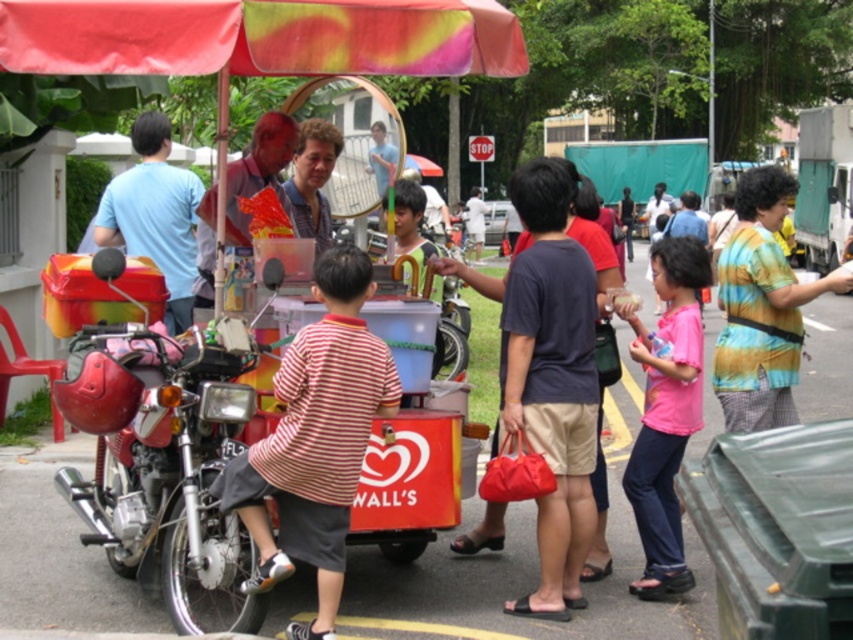
You are standing at the food stall and want to reach the point marked as point (161,182). Which direction should you move relative to point (824,189)?

You should move forward towards point (161,182) since it is in front of point (824,189).

You are a photographer standing in the middle of the street. You want to take a photo that includes both the light blue shirt at left and the metallic silver food truck at right. Which object should you focus on first to ensure both are in the frame?

The light blue shirt at left has a lesser height compared to the metallic silver food truck at right, so you should focus on the metallic silver food truck at right first to ensure both are in the frame.